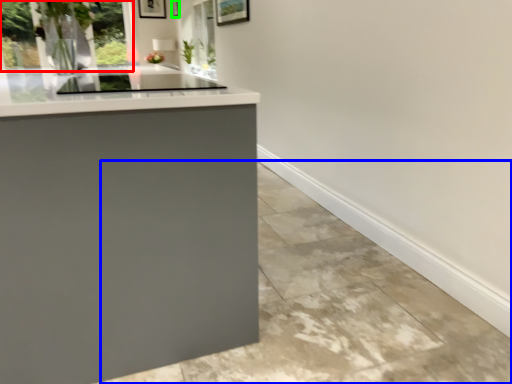
Question: Considering the real-world distances, which object is closest to window (highlighted by a red box)? concrete (highlighted by a blue box) or picture frame (highlighted by a green box).

Choices:
 (A) concrete
 (B) picture frame

Answer: (A)